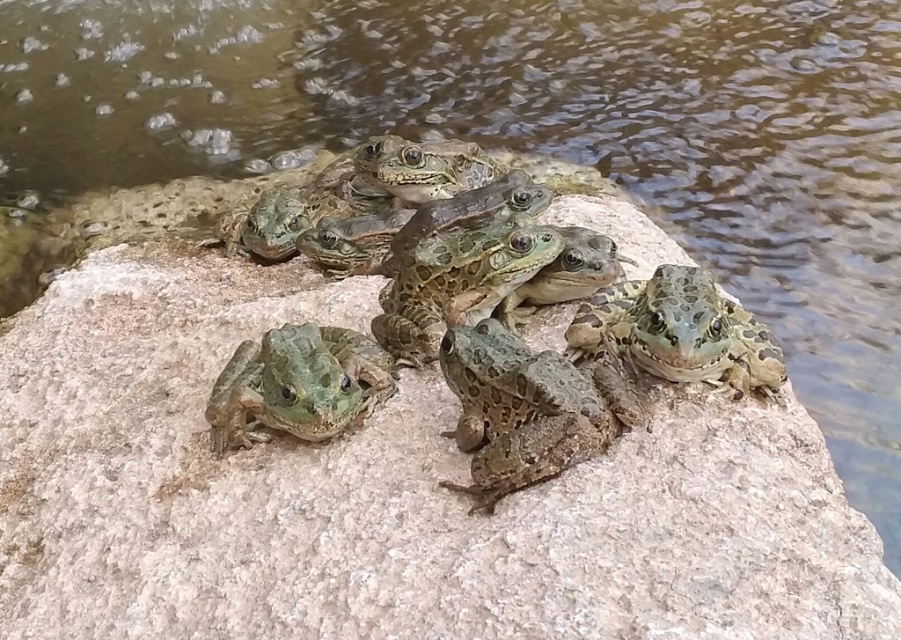
Consider the image. Is green spotted frogs at center closer to camera compared to green textured frog at center?

Yes.

Is point (461, 492) positioned before point (346, 349)?

Yes, it is in front of point (346, 349).

Who is more forward, [412,240] or [329,339]?

Point [329,339] is in front.

This screenshot has height=640, width=901. Identify the location of green spotted frogs at center. (563, 332).

Does speckled brown skin at center appear on the right side of green textured frog at center?

Indeed, speckled brown skin at center is positioned on the right side of green textured frog at center.

Does speckled brown skin at center come in front of green textured frog at center?

Yes, speckled brown skin at center is in front of green textured frog at center.

You are a GUI agent. You are given a task and a screenshot of the screen. Output one action in this format:
    pyautogui.click(x=<x>, y=<y>)
    Task: Click on the speckled brown skin at center
    This screenshot has height=640, width=901.
    Given the screenshot: What is the action you would take?
    pyautogui.click(x=519, y=410)

You are a GUI agent. You are given a task and a screenshot of the screen. Output one action in this format:
    pyautogui.click(x=<x>, y=<y>)
    Task: Click on the green spotted frogs at center
    The width and height of the screenshot is (901, 640).
    Given the screenshot: What is the action you would take?
    pyautogui.click(x=563, y=332)

Who is positioned more to the left, green spotted frogs at center or speckled brown skin at center?

green spotted frogs at center is more to the left.

What are the coordinates of `green spotted frogs at center` in the screenshot? It's located at (563, 332).